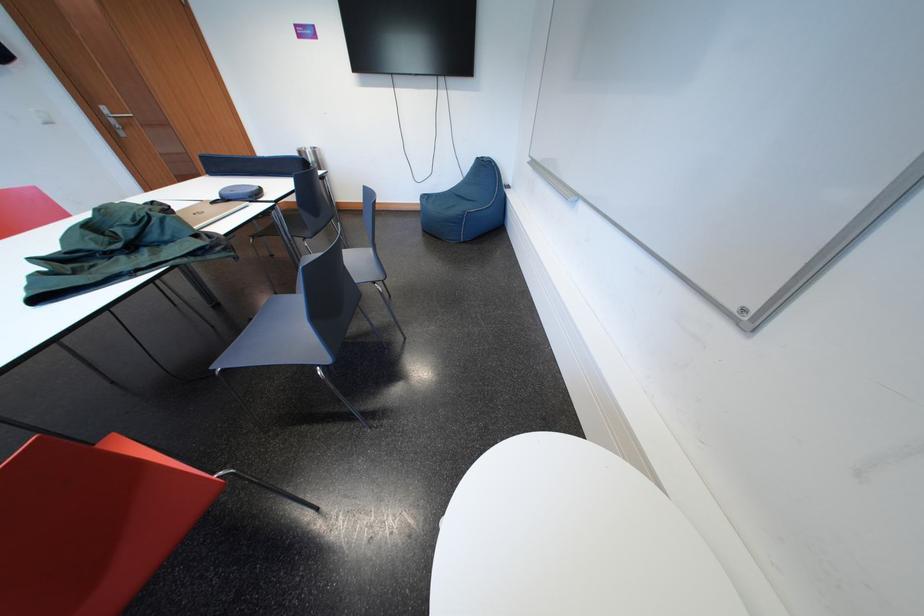
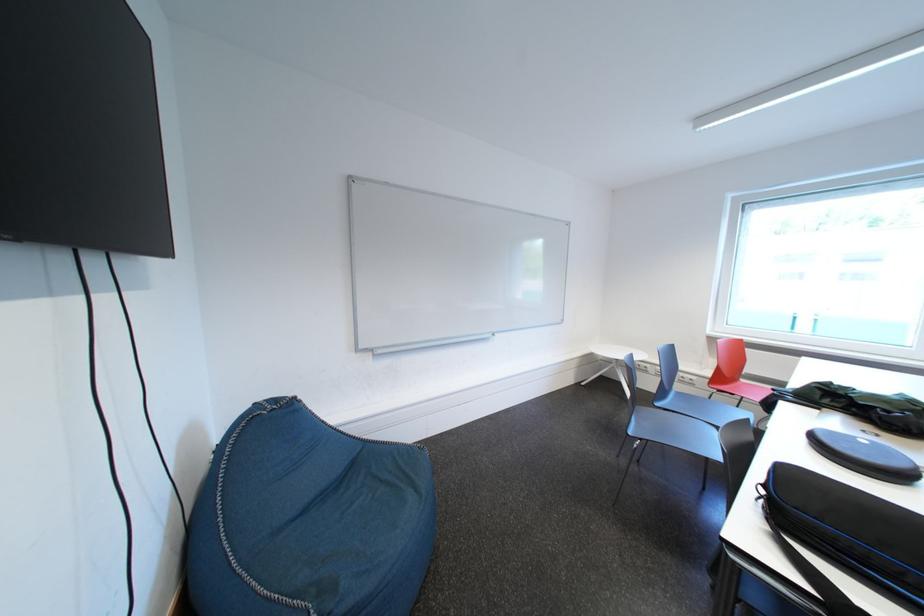
Question: I am providing you with two images of the same scene from different viewpoints. Which of the following objects are not visible in image2?

Choices:
 (A) black zippered case
 (B) grey chair sitting surface
 (C) red chair sitting surface
 (D) blue juice carton

Answer: (B)